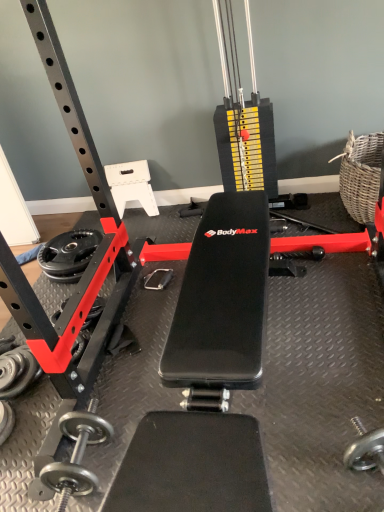
You are a GUI agent. You are given a task and a screenshot of the screen. Output one action in this format:
    pyautogui.click(x=<x>, y=<y>)
    Task: Click on the vacant space to the right of black rubber dumbbell at lower left, acting as the 1th dumbbell starting from the top
    The image size is (384, 512).
    Given the screenshot: What is the action you would take?
    pyautogui.click(x=46, y=390)